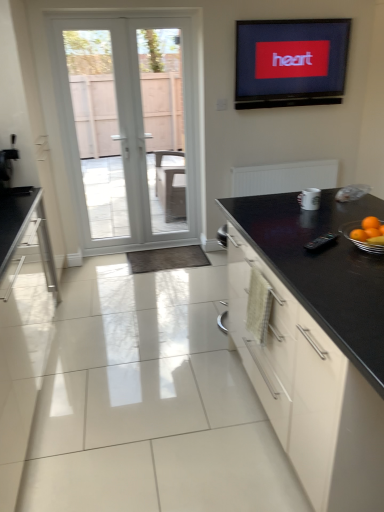
Question: In terms of size, does black glossy cabinet at right appear bigger or smaller than orange matte at right?

Choices:
 (A) small
 (B) big

Answer: (B)

Question: From the image's perspective, is black glossy cabinet at right positioned above or below orange matte at right?

Choices:
 (A) below
 (B) above

Answer: (A)

Question: Which of these objects is positioned closest to the black plastic remote control at center, the second appliance viewed from the back?

Choices:
 (A) white ceramic mug at upper right, which is the second appliance from front to back
 (B) orange matte at right
 (C) black glossy cabinet at right
 (D) white glass door at left
 (E) flat screen tv at upper center

Answer: (B)

Question: Which object is the closest to the black glossy cabinet at right?

Choices:
 (A) black plastic remote control at center, which is the 2th appliance in top-to-bottom order
 (B) orange matte at right
 (C) flat screen tv at upper center
 (D) white ceramic mug at upper right, which is the 2th appliance in bottom-to-top order
 (E) white glass door at left

Answer: (A)